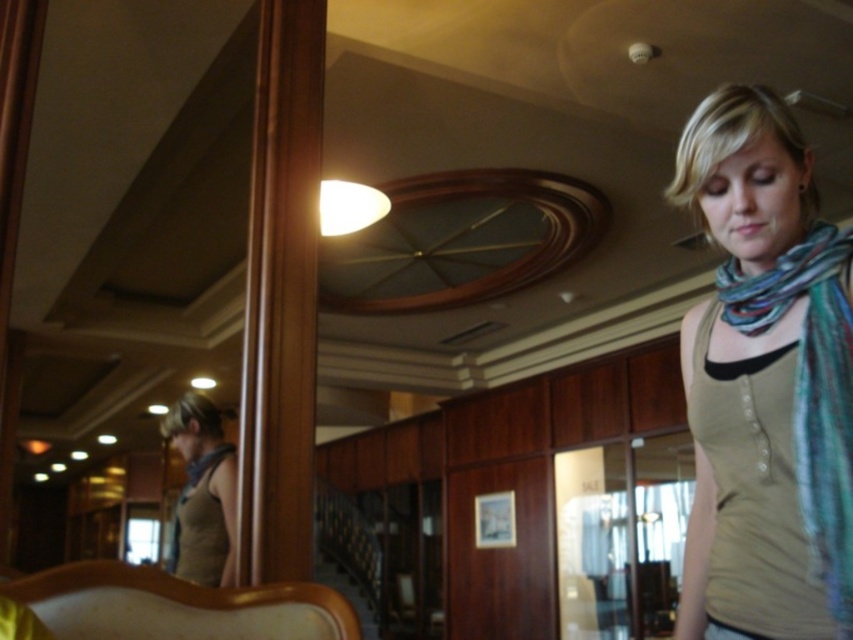
Is point (821, 285) closer to camera compared to point (189, 392)?

That is True.

Measure the distance from multicolored woven scarf at right to matte brown scarf at left.

They are 5.87 feet apart.

Does point (846, 528) come closer to viewer compared to point (186, 500)?

Yes.

The image size is (853, 640). Identify the location of multicolored woven scarf at right. (811, 392).